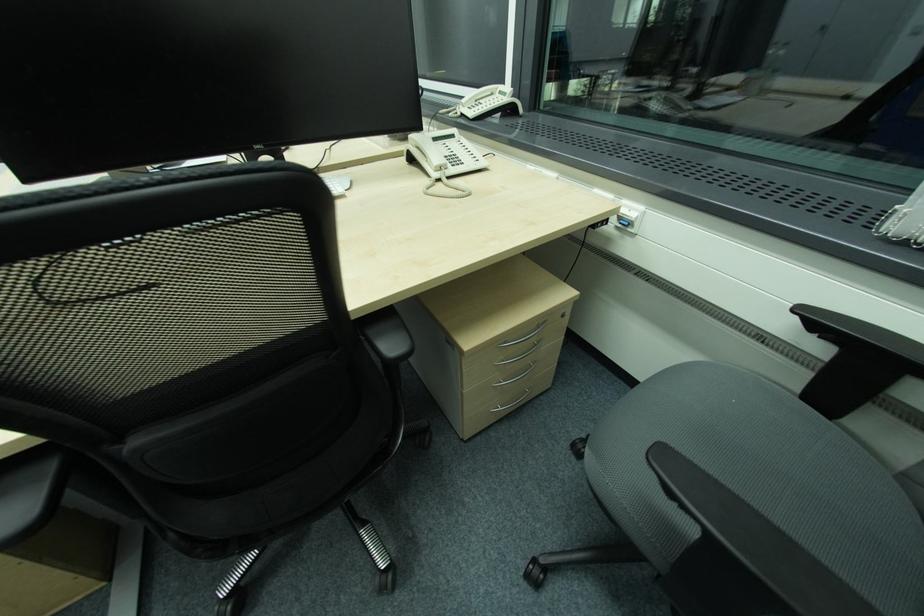
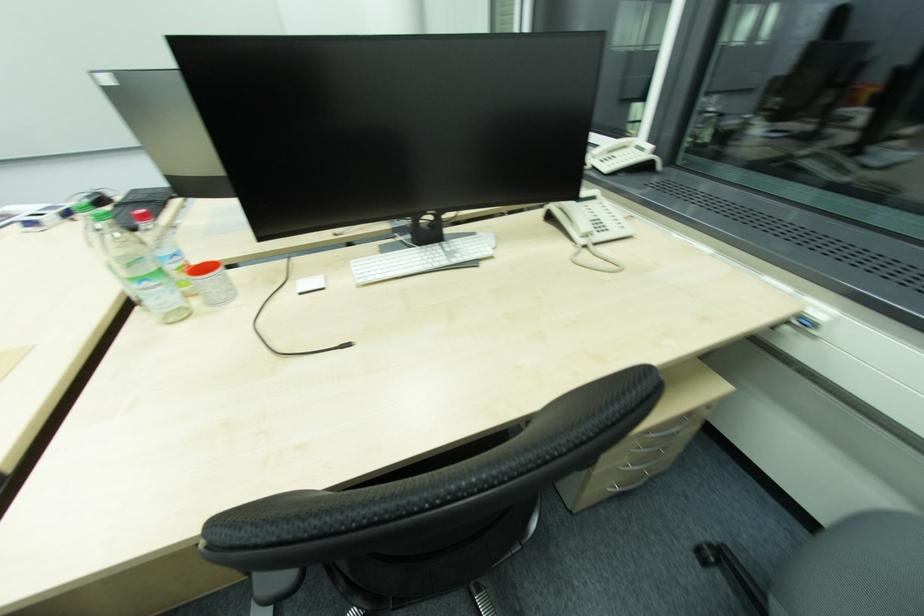
Question: The images are taken continuously from a first-person perspective. In which direction is your viewpoint rotating?

Choices:
 (A) Left
 (B) Right
 (C) Up
 (D) Down

Answer: (A)